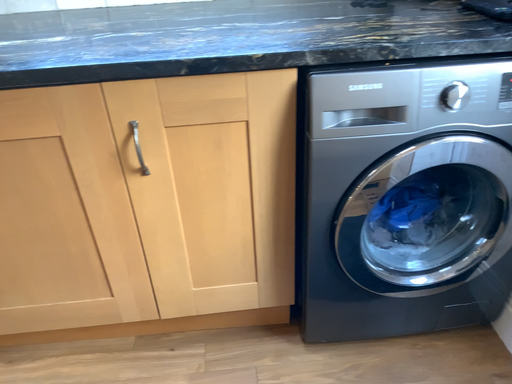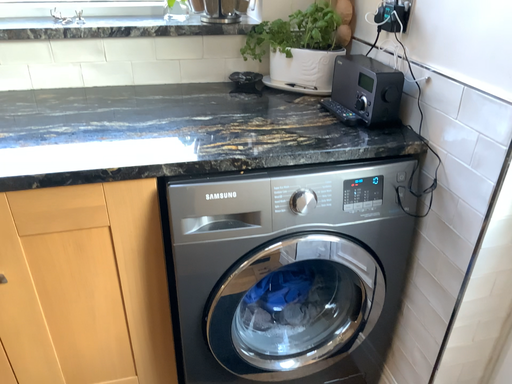
Question: How did the camera likely rotate when shooting the video?

Choices:
 (A) rotated right
 (B) rotated left

Answer: (A)